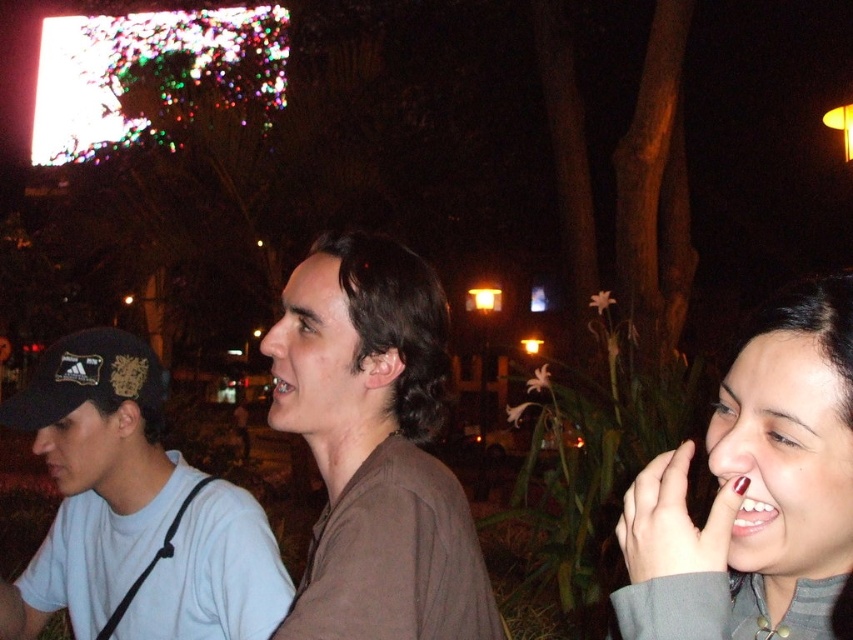
You are planning to take a photo of the two people wearing the matte gray sweater at right and the white matte shirt at left. Which one should you zoom in on if you want to capture the thinner clothing item?

The matte gray sweater at right is thinner than the white matte shirt at left, so you should zoom in on the matte gray sweater at right to capture the thinner clothing item.

You are standing at the point with coordinates point [32,419] and want to walk towards the point with coordinates point [335,488]. Will you be moving forward or backward relative to your current position?

Point [335,488] is in front of point [32,419], so moving towards it would mean moving forward relative to your current position.

You are standing at the origin point of the coordinate system in the image. You want to locate the brown matte shirt at center. What are its coordinates?

The coordinates of the brown matte shirt at center are at point (x=375, y=449).